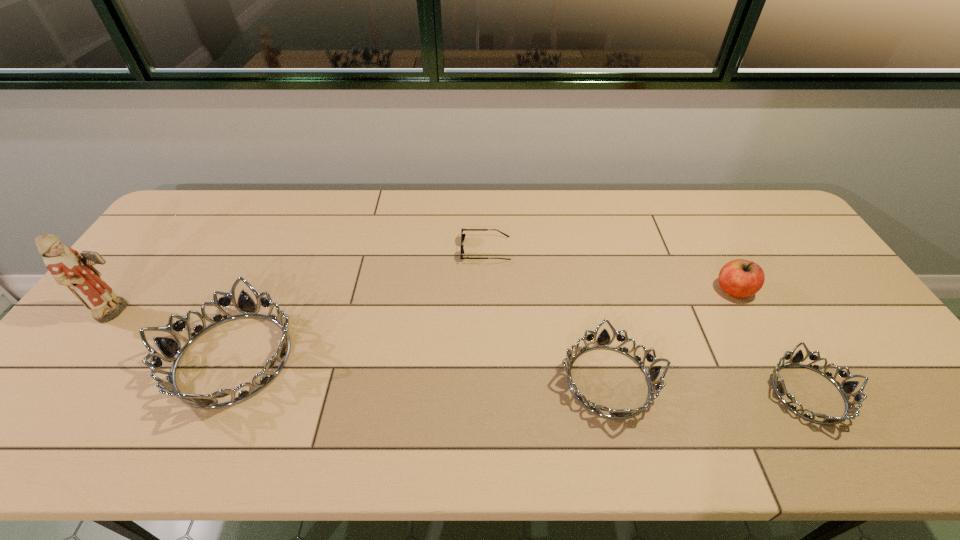
Identify the location of the tallest tiara. (171, 350).

Identify the location of the leftmost tiara. (171, 350).

Image resolution: width=960 pixels, height=540 pixels. I want to click on the third shortest object, so click(x=603, y=341).

Where is `the fourth object from left to right`? This screenshot has height=540, width=960. the fourth object from left to right is located at coordinates click(x=603, y=341).

Where is `the fifth tallest object`? The width and height of the screenshot is (960, 540). the fifth tallest object is located at coordinates (846, 387).

In order to click on the shortest tiara in this screenshot , I will do `click(846, 387)`.

Image resolution: width=960 pixels, height=540 pixels. In order to click on the tallest object in this screenshot , I will do `click(67, 266)`.

The image size is (960, 540). What are the coordinates of `figurine` in the screenshot? It's located at (67, 266).

Locate an element on the screen. the farthest object is located at coordinates (462, 235).

I want to click on the shortest object, so click(x=462, y=235).